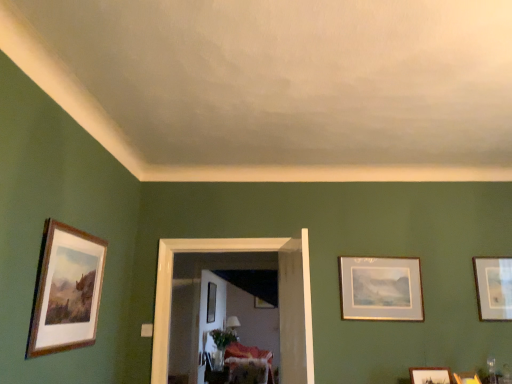
Question: Relative to velvet floral sofa at center, is wooden picture frame at lower right, which ranks as the 2th picture frame in front-to-back order, in front or behind?

Choices:
 (A) behind
 (B) front

Answer: (B)

Question: From a real-world perspective, relative to velvet floral sofa at center, is wooden picture frame at lower right, marked as the sixth picture frame in a left-to-right arrangement, vertically above or below?

Choices:
 (A) below
 (B) above

Answer: (B)

Question: Considering the real-world distances, which object is closest to the wooden picture frame at lower right, which ranks as the 2th picture frame in front-to-back order?

Choices:
 (A) wooden picture frame at center, arranged as the 1th picture frame when ordered from the bottom
 (B) wooden frame at left, arranged as the 7th picture frame when viewed from the right
 (C) wooden table at center
 (D) wooden framed picture at right, the 7th picture frame in the left-to-right sequence
 (E) wooden frame at upper right, acting as the 5th picture frame starting from the top

Answer: (E)

Question: Which object is positioned closest to the velvet floral sofa at center?

Choices:
 (A) translucent glass vase at center
 (B) wooden picture frame at lower right, which is the second picture frame in right-to-left order
 (C) matte black picture frame at center, the sixth picture frame from the right
 (D) wooden frame at upper right, which ranks as the 3th picture frame in right-to-left order
 (E) wooden table at center

Answer: (E)